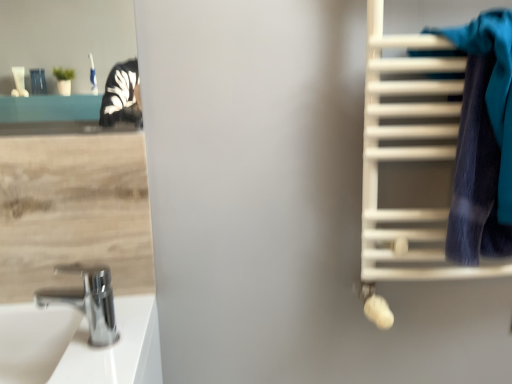
Question: Considering the positions of white matte towel rack at right and white glossy sink at lower left in the image, is white matte towel rack at right bigger or smaller than white glossy sink at lower left?

Choices:
 (A) big
 (B) small

Answer: (A)

Question: Is white matte towel rack at right inside or outside of white glossy sink at lower left?

Choices:
 (A) outside
 (B) inside

Answer: (A)

Question: Which is farther from the white glossy sink at lower left?

Choices:
 (A) chrome metallic faucet at lower left
 (B) white matte towel rack at right
 (C) blue fabric towel at right

Answer: (C)

Question: Based on their relative distances, which object is nearer to the blue fabric towel at right?

Choices:
 (A) chrome metallic faucet at lower left
 (B) white matte towel rack at right
 (C) white glossy sink at lower left

Answer: (B)